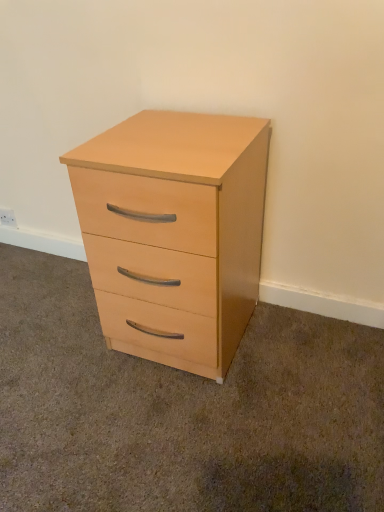
Question: Does light wood/finish chest of drawers at center come in front of white plastic electric outlet at lower left?

Choices:
 (A) no
 (B) yes

Answer: (B)

Question: Is white plastic electric outlet at lower left completely or partially inside light wood/finish chest of drawers at center?

Choices:
 (A) yes
 (B) no

Answer: (B)

Question: Is light wood/finish chest of drawers at center shorter than white plastic electric outlet at lower left?

Choices:
 (A) yes
 (B) no

Answer: (B)

Question: Is the position of light wood/finish chest of drawers at center more distant than that of white plastic electric outlet at lower left?

Choices:
 (A) yes
 (B) no

Answer: (B)

Question: Does light wood/finish chest of drawers at center have a greater height compared to white plastic electric outlet at lower left?

Choices:
 (A) yes
 (B) no

Answer: (A)

Question: Is the surface of light wood/finish chest of drawers at center in direct contact with white plastic electric outlet at lower left?

Choices:
 (A) yes
 (B) no

Answer: (B)

Question: Considering the relative sizes of white plastic electric outlet at lower left and light wood/finish chest of drawers at center in the image provided, is white plastic electric outlet at lower left taller than light wood/finish chest of drawers at center?

Choices:
 (A) yes
 (B) no

Answer: (B)

Question: Is white plastic electric outlet at lower left outside of light wood/finish chest of drawers at center?

Choices:
 (A) yes
 (B) no

Answer: (A)

Question: Considering the relative sizes of white plastic electric outlet at lower left and light wood/finish chest of drawers at center in the image provided, is white plastic electric outlet at lower left wider than light wood/finish chest of drawers at center?

Choices:
 (A) no
 (B) yes

Answer: (A)

Question: Does white plastic electric outlet at lower left have a lesser width compared to light wood/finish chest of drawers at center?

Choices:
 (A) no
 (B) yes

Answer: (B)

Question: Is white plastic electric outlet at lower left positioned with its back to light wood/finish chest of drawers at center?

Choices:
 (A) yes
 (B) no

Answer: (B)

Question: Is white plastic electric outlet at lower left oriented towards light wood/finish chest of drawers at center?

Choices:
 (A) yes
 (B) no

Answer: (B)

Question: In the image, is white plastic electric outlet at lower left positioned in front of or behind light wood/finish chest of drawers at center?

Choices:
 (A) front
 (B) behind

Answer: (B)